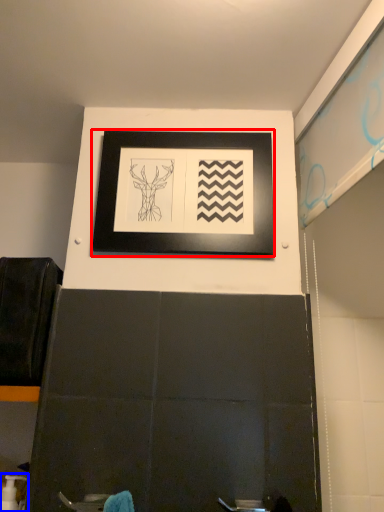
Question: Which point is further to the camera, picture frame (highlighted by a red box) or toiletry (highlighted by a blue box)?

Choices:
 (A) picture frame
 (B) toiletry

Answer: (A)